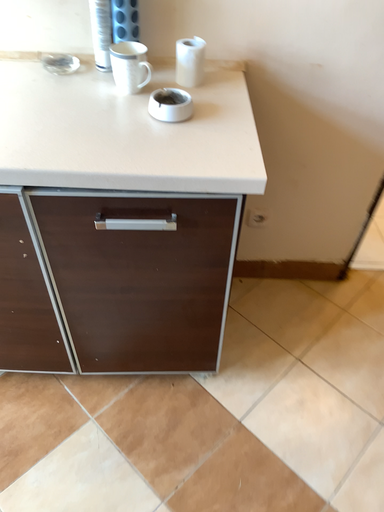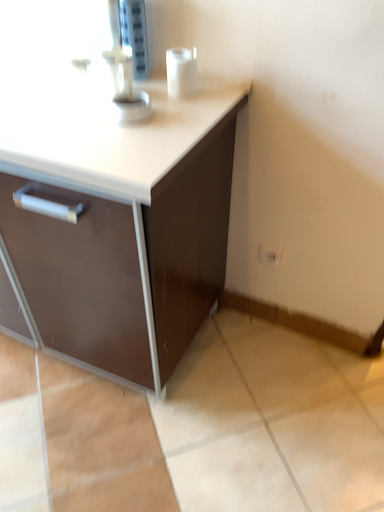
Question: How did the camera likely rotate when shooting the video?

Choices:
 (A) rotated right
 (B) rotated left

Answer: (B)